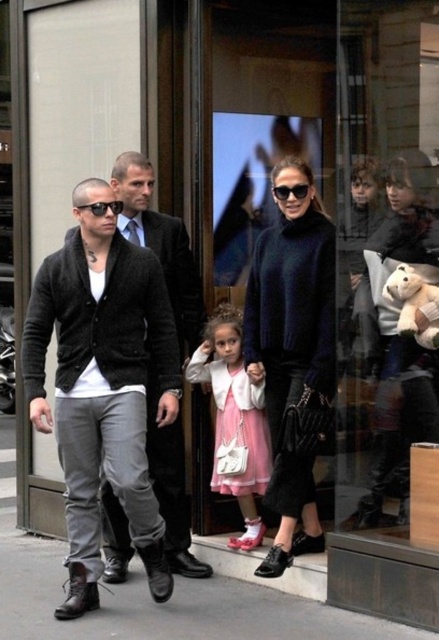
You are a fashion designer observing the pedestrians in the urban scene. You notice the dark gray cardigan at left and the black plastic sunglasses at left. Which item is located more to the left?

The dark gray cardigan at left is positioned on the left side of the black plastic sunglasses at left, so the dark gray cardigan at left is more to the left.

You are a fashion designer observing the two outfits in the scene. The outfits are the dark gray knit sweater at center and the pink satin dress at center. Based on their positions, which outfit is closer to the storefront window?

The dark gray knit sweater at center is 60.03 centimeters from the pink satin dress at center. Since the distance between them is specified, both outfits are positioned at the center, so their proximity to the storefront window cannot be determined solely by their separation distance. Additional spatial information about their location relative to the window is needed.